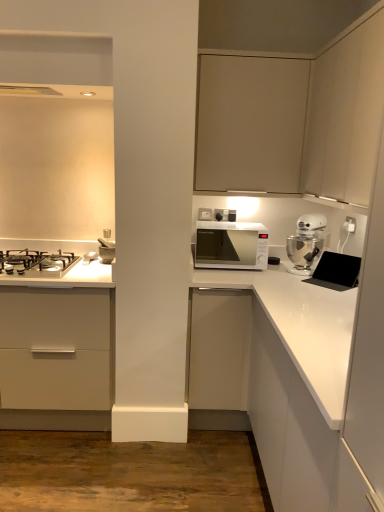
Question: In terms of height, does matte beige cabinet at upper center, the 1th cabinetry from the top, look taller or shorter compared to matte beige cabinet at upper right, which appears as the fourth cabinetry when ordered from the bottom?

Choices:
 (A) short
 (B) tall

Answer: (A)

Question: Considering the positions of point (230, 187) and point (382, 72), is point (230, 187) closer or farther from the camera than point (382, 72)?

Choices:
 (A) closer
 (B) farther

Answer: (B)

Question: Based on their relative distances, which object is nearer to the matte beige cabinet at upper center, the third cabinetry from the top?

Choices:
 (A) white plastic electric outlet at upper right
 (B) white glossy countertop at center, acting as the 1th countertop starting from the bottom
 (C) white glossy stand mixer at upper right
 (D) white matte cabinet at center, which ranks as the fourth cabinetry in top-to-bottom order
 (E) matte beige cabinet at upper center, the fifth cabinetry positioned from the bottom

Answer: (E)

Question: Considering the real-world distances, which object is closest to the white glossy stand mixer at upper right?

Choices:
 (A) matte white exhaust hood at upper left
 (B) matte beige cabinet at upper center, the third cabinetry from the top
 (C) white glossy countertop at lower left, which is counted as the second countertop, starting from the right
 (D) white matte cabinet at center, the 2th cabinetry in the bottom-to-top sequence
 (E) white glossy countertop at right, which is the 5th cabinetry from top to bottom

Answer: (B)